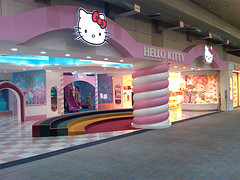
Image resolution: width=240 pixels, height=180 pixels. Find the location of `pink and white linoleum`. pink and white linoleum is located at coordinates (19, 153), (21, 141).